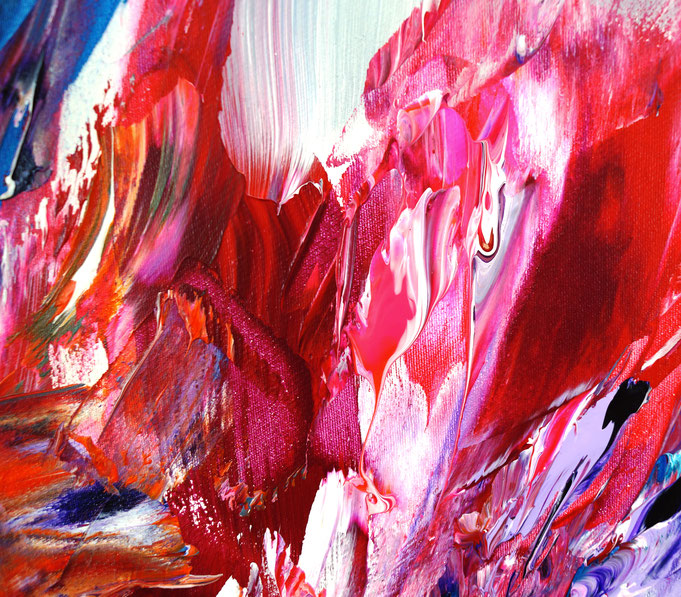
Find the location of a particular element. The height and width of the screenshot is (597, 681). orange paint is located at coordinates (x=191, y=313).